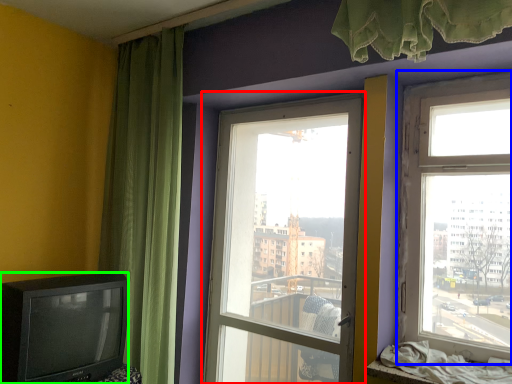
Question: Which is nearer to the window (highlighted by a red box)? window (highlighted by a blue box) or television (highlighted by a green box).

Choices:
 (A) window
 (B) television

Answer: (A)